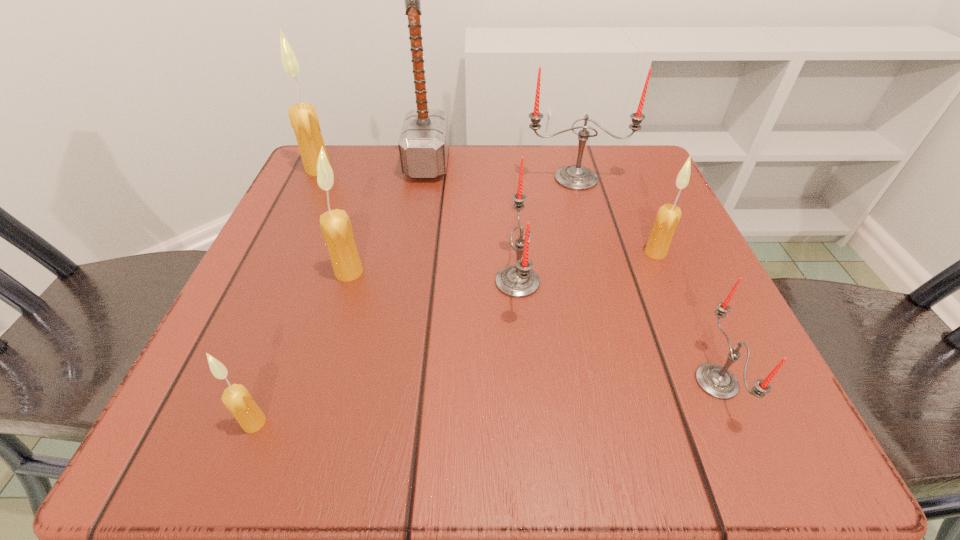
You are a GUI agent. You are given a task and a screenshot of the screen. Output one action in this format:
    pyautogui.click(x=<x>, y=<y>)
    Task: Click on the brown hammer
    
    Given the screenshot: What is the action you would take?
    pyautogui.click(x=423, y=144)

Where is `the fifth object from right to left`? The height and width of the screenshot is (540, 960). the fifth object from right to left is located at coordinates (423, 144).

Find the location of `the leftmost candle`. the leftmost candle is located at coordinates (303, 117).

The height and width of the screenshot is (540, 960). I want to click on the second tallest object, so click(303, 117).

Where is `the farthest red candle`? the farthest red candle is located at coordinates 574,177.

The height and width of the screenshot is (540, 960). Identify the location of the third object from left to right. (338, 235).

This screenshot has height=540, width=960. What are the coordinates of `the third cream candle from left to right` in the screenshot? It's located at (338, 235).

Locate an element on the screen. the second biggest red candle is located at coordinates (518, 281).

The width and height of the screenshot is (960, 540). I want to click on the rightmost cream candle, so click(667, 219).

Identify the location of the second farthest cream candle. This screenshot has width=960, height=540. (667, 219).